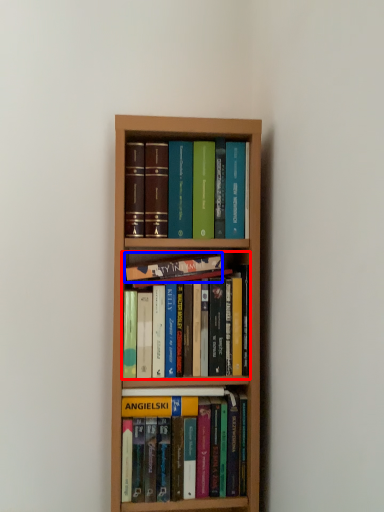
Question: Among these objects, which one is farthest to the camera, book (highlighted by a red box) or book (highlighted by a blue box)?

Choices:
 (A) book
 (B) book

Answer: (B)